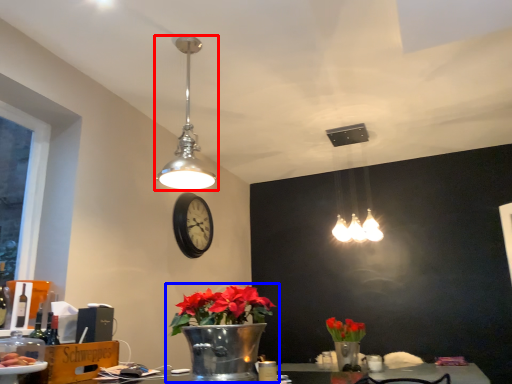
Question: Which point is further to the camera, lamp (highlighted by a red box) or houseplant (highlighted by a blue box)?

Choices:
 (A) lamp
 (B) houseplant

Answer: (A)